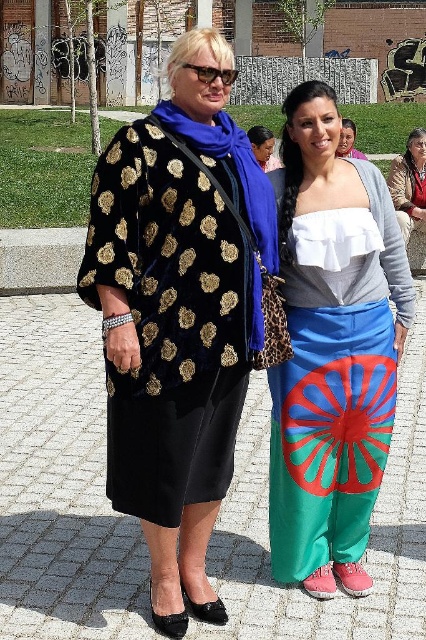
Question: Which object is the closest to the matte blue pants at center?

Choices:
 (A) velvet gold shawl at center
 (B) velvet/black jacket at center

Answer: (A)

Question: Which of the following is the farthest from the observer?

Choices:
 (A) matte blue pants at center
 (B) velvet gold shawl at center
 (C) matte brown leather jacket at upper right

Answer: (C)

Question: Where is velvet/black jacket at center located in relation to velvet gold shawl at center in the image?

Choices:
 (A) left
 (B) right

Answer: (A)

Question: Can you confirm if velvet/black jacket at center is positioned below matte blue pants at center?

Choices:
 (A) yes
 (B) no

Answer: (A)

Question: Does velvet/black jacket at center have a larger size compared to matte brown leather jacket at upper right?

Choices:
 (A) yes
 (B) no

Answer: (A)

Question: Which object appears closest to the camera in this image?

Choices:
 (A) velvet gold shawl at center
 (B) matte brown leather jacket at upper right
 (C) velvet/black jacket at center
 (D) matte blue pants at center

Answer: (C)